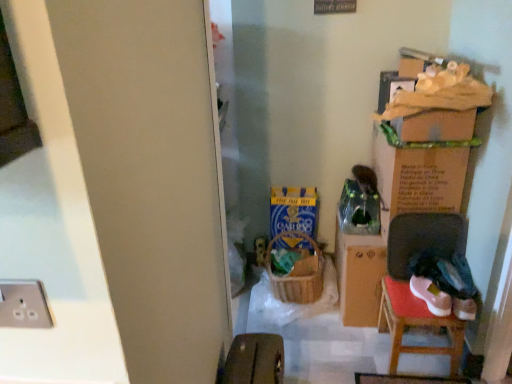
Question: Is blue cardboard box at center, marked as the 2th cardboard box in a right-to-left arrangement, inside the boundaries of silver metallic socket at lower left, or outside?

Choices:
 (A) inside
 (B) outside

Answer: (B)

Question: Visually, is blue cardboard box at center, the first cardboard box in the left-to-right sequence, positioned to the left or to the right of silver metallic socket at lower left?

Choices:
 (A) left
 (B) right

Answer: (B)

Question: Which of these objects is positioned closest to the blue cardboard box at center, marked as the 2th cardboard box in a right-to-left arrangement?

Choices:
 (A) matte brown suitcase at lower center
 (B) silver metallic socket at lower left
 (C) wooden chair at lower right
 (D) cardboard box at upper right, which is the second cardboard box in left-to-right order
 (E) woven brown laundry basket at center

Answer: (E)

Question: Which object is positioned farthest from the wooden chair at lower right?

Choices:
 (A) matte brown suitcase at lower center
 (B) woven brown laundry basket at center
 (C) silver metallic socket at lower left
 (D) cardboard box at upper right, which is the second cardboard box in left-to-right order
 (E) blue cardboard box at center, marked as the 2th cardboard box in a right-to-left arrangement

Answer: (C)